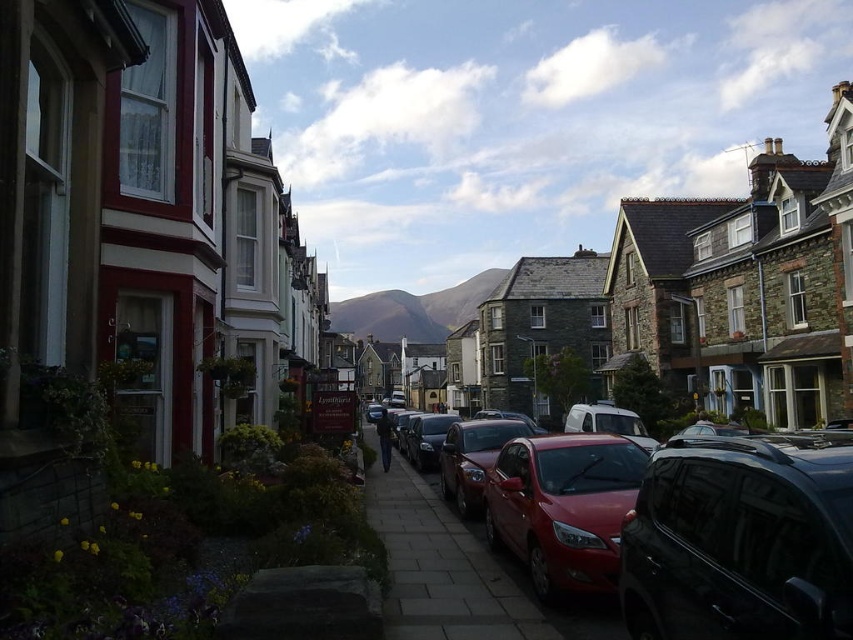
You are standing on the street and want to walk towards the two points marked in the image. Which point, point (457,541) or point (444,454), will you reach first?

You will reach point (457,541) first because it is closer to the viewer than point (444,454).

You are driving a car that is 4 meters long and want to park it between the glossy red car at center and the shiny red car at center. Is there enough space between them to park your car?

The distance between the glossy red car at center and the shiny red car at center is 3.69 meters. Since your car is 4 meters long, there isn not enough space to park between them.